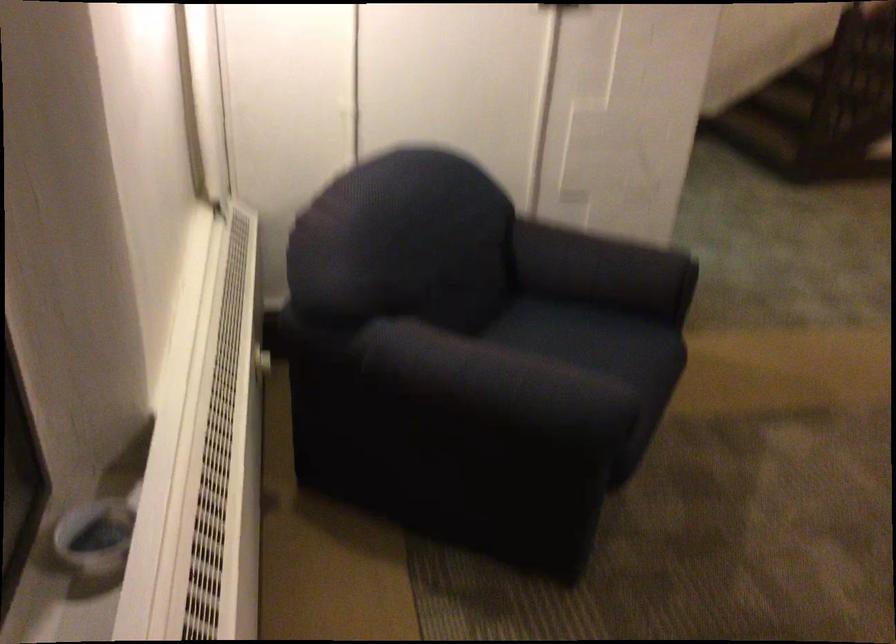
This screenshot has width=896, height=644. What do you see at coordinates (218, 462) in the screenshot?
I see `a white radiator dial` at bounding box center [218, 462].